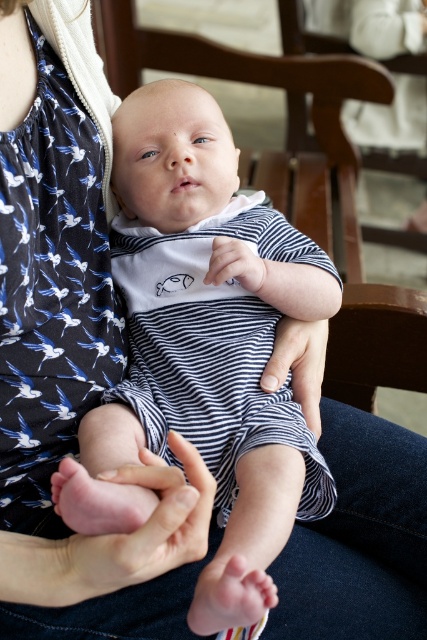
You are a photographer trying to capture the baby in the image. The baby has a pink flesh area at the center. To ensure the pink flesh at center is in focus, where should you aim the camera? Please provide the coordinates as a point in the format of point followed by the coordinates in parentheses.

The pink flesh at center is located at point (149, 525), so aim the camera at point (149, 525) to ensure it is in focus.